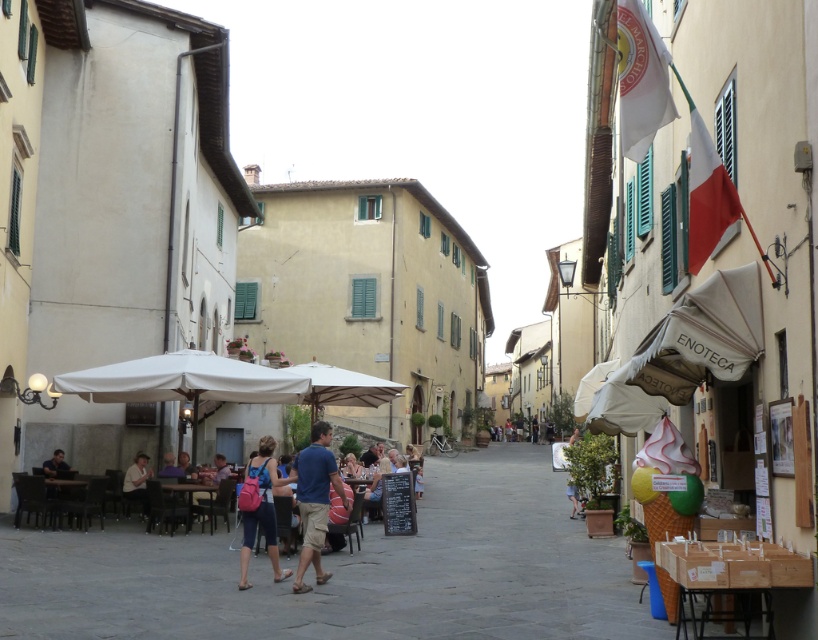
Question: Which point appears farthest from the camera in this image?

Choices:
 (A) (574, 513)
 (B) (142, 451)
 (C) (246, 513)

Answer: (A)

Question: Which of these objects is positioned farthest from the light brown leather jacket at lower left?

Choices:
 (A) blue cotton shirt at center
 (B) light blue denim shorts at lower right
 (C) white fabric umbrella at center
 (D) pink fabric backpack at center

Answer: (B)

Question: Where is pink fabric backpack at center located in relation to light brown leather jacket at lower left in the image?

Choices:
 (A) right
 (B) left

Answer: (A)

Question: Which point is farther to the camera?

Choices:
 (A) blue cotton shirt at center
 (B) light brown leather jacket at lower left

Answer: (B)

Question: Is light brown leather jacket at lower left wider than light blue denim shorts at lower right?

Choices:
 (A) no
 (B) yes

Answer: (A)

Question: Observing the image, what is the correct spatial positioning of white fabric umbrella at center in reference to light brown leather jacket at lower left?

Choices:
 (A) above
 (B) below

Answer: (A)